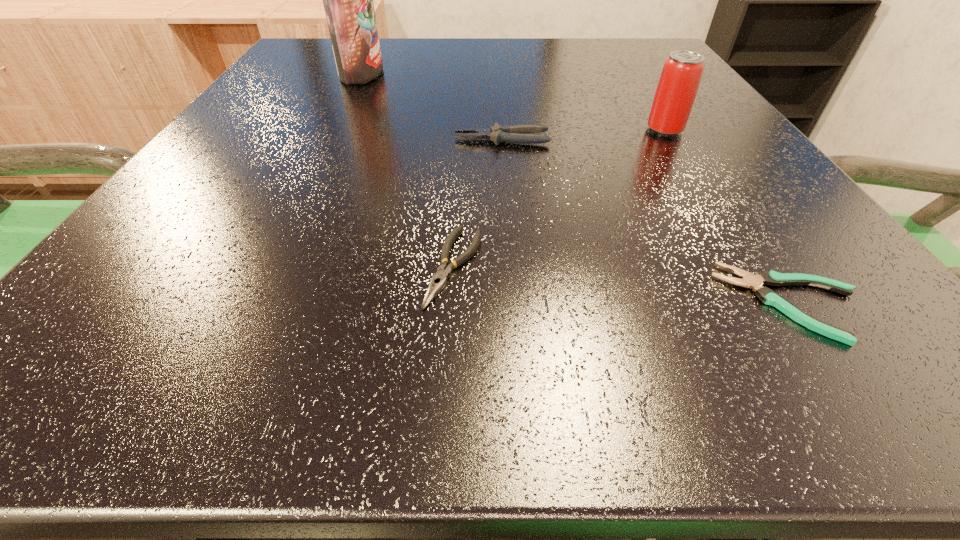
Image resolution: width=960 pixels, height=540 pixels. Find the location of `shampoo`. shampoo is located at coordinates (348, 0).

Identify the location of the tallest object. Image resolution: width=960 pixels, height=540 pixels. [x=348, y=0].

The width and height of the screenshot is (960, 540). Identify the location of beer can. (682, 71).

I want to click on the farthest pliers, so click(515, 133).

This screenshot has width=960, height=540. Find the location of `the third tallest object`. the third tallest object is located at coordinates (515, 133).

Locate an element on the screen. The image size is (960, 540). the second shortest object is located at coordinates (438, 281).

This screenshot has width=960, height=540. I want to click on the shortest pliers, so click(x=769, y=297).

You are a GUI agent. You are given a task and a screenshot of the screen. Output one action in this format:
    pyautogui.click(x=<x>, y=<y>)
    Task: Click on the shortest object
    This screenshot has height=540, width=960.
    Given the screenshot: What is the action you would take?
    pyautogui.click(x=769, y=297)

This screenshot has height=540, width=960. Find the location of `free location located 0.060m on the front label of the shampoo`. free location located 0.060m on the front label of the shampoo is located at coordinates (413, 72).

Find the location of a particular element. The width and height of the screenshot is (960, 540). free point located on the front of the beer can is located at coordinates (692, 173).